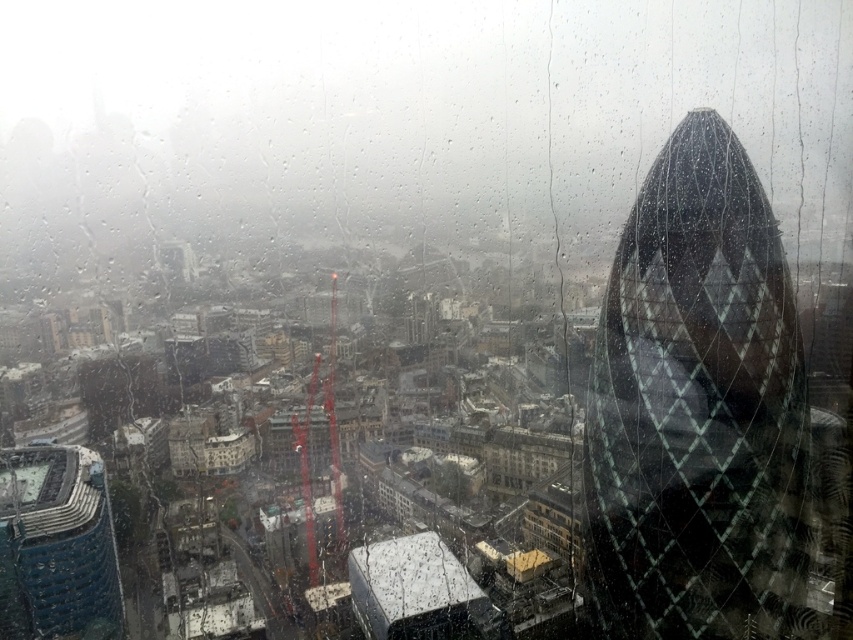
Is glassy diamond-patterned tower at right smaller than blue glass tower at lower left?

Incorrect, glassy diamond-patterned tower at right is not smaller in size than blue glass tower at lower left.

Who is taller, glassy diamond-patterned tower at right or blue glass tower at lower left?

With more height is glassy diamond-patterned tower at right.

Measure the distance between glassy diamond-patterned tower at right and camera.

They are 359.89 feet apart.

Find the location of a particular element. Image resolution: width=853 pixels, height=640 pixels. glassy diamond-patterned tower at right is located at coordinates (698, 412).